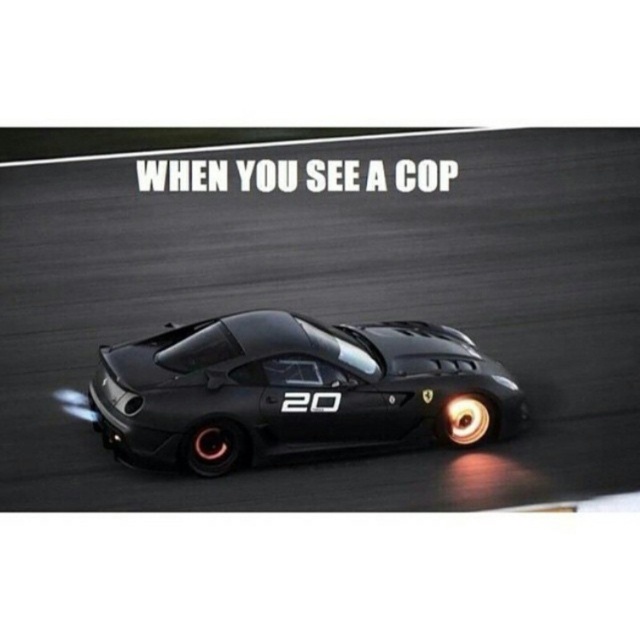
Question: Considering the relative positions of black asphalt at center and matte black sports car at center in the image provided, where is black asphalt at center located with respect to matte black sports car at center?

Choices:
 (A) above
 (B) below

Answer: (A)

Question: Is black asphalt at center to the right of matte black sports car at center from the viewer's perspective?

Choices:
 (A) yes
 (B) no

Answer: (A)

Question: Which point is closer to the camera?

Choices:
 (A) (221, 337)
 (B) (24, 401)

Answer: (A)

Question: Does black asphalt at center come behind matte black sports car at center?

Choices:
 (A) yes
 (B) no

Answer: (A)

Question: Which of the following is the closest to the observer?

Choices:
 (A) (476, 435)
 (B) (35, 273)

Answer: (A)